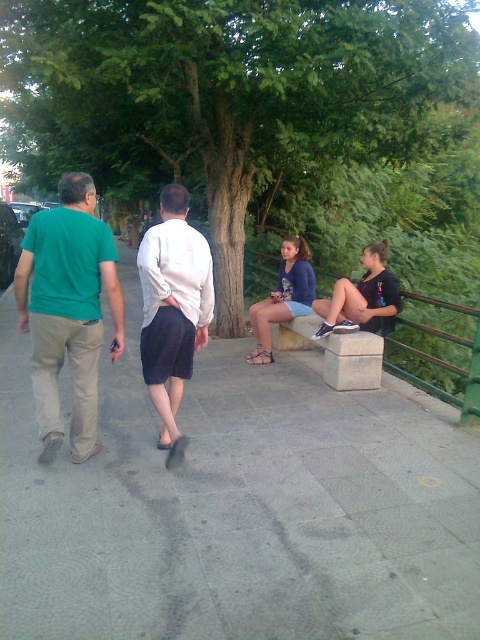
Does white matte shirt at center have a greater height compared to black matte shorts at lower right?

Indeed, white matte shirt at center has a greater height compared to black matte shorts at lower right.

The image size is (480, 640). What do you see at coordinates (172, 308) in the screenshot?
I see `white matte shirt at center` at bounding box center [172, 308].

Find the location of a particular element. white matte shirt at center is located at coordinates (172, 308).

Which is in front, point (328, 320) or point (296, 266)?

Point (328, 320) is more forward.

Is point (376, 260) positioned before point (309, 289)?

That is True.

Is point (377, 308) closer to viewer compared to point (312, 291)?

That is True.

The image size is (480, 640). What are the coordinates of `black matte shorts at lower right` in the screenshot? It's located at (362, 298).

Based on the photo, does green leafy tree at center appear under blue denim shorts at center?

No, green leafy tree at center is not below blue denim shorts at center.

This screenshot has width=480, height=640. Describe the element at coordinates (226, 96) in the screenshot. I see `green leafy tree at center` at that location.

Which is behind, point (360, 148) or point (268, 321)?

Point (360, 148)

Identify the location of green leafy tree at center. (226, 96).